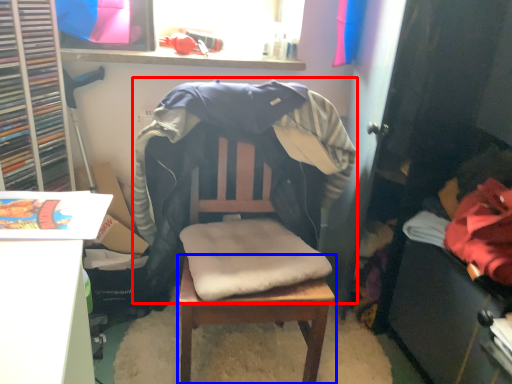
Question: Which point is further to the camera, bean bag chair (highlighted by a red box) or table (highlighted by a blue box)?

Choices:
 (A) bean bag chair
 (B) table

Answer: (B)